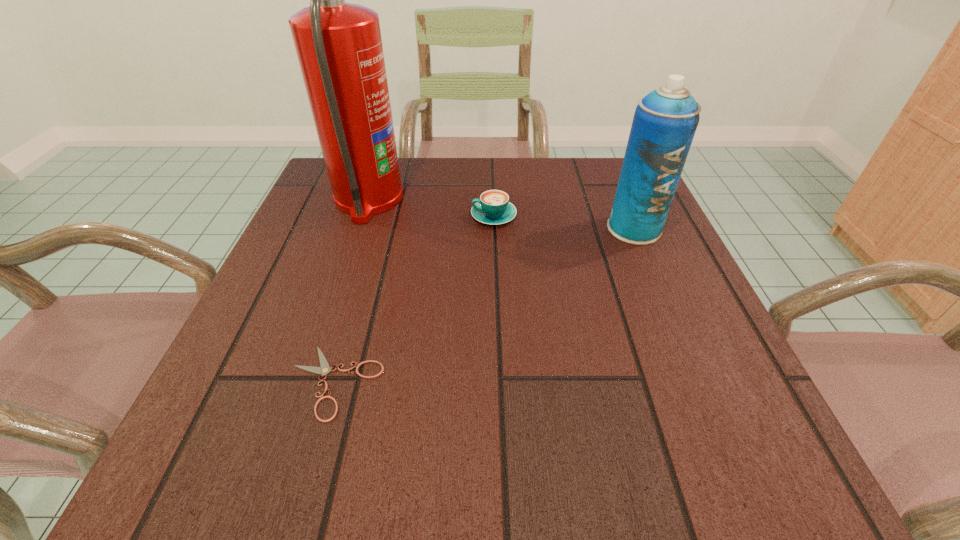
Where is `the tallest object`? the tallest object is located at coordinates coord(339,47).

Locate an element on the screen. Image resolution: width=960 pixels, height=540 pixels. the rightmost object is located at coordinates (665, 121).

At what (x,y) coordinates should I click in order to perform the action: click on the second tallest object. Please return your answer as a coordinate pair (x, y). Image resolution: width=960 pixels, height=540 pixels. Looking at the image, I should click on (665, 121).

The width and height of the screenshot is (960, 540). What are the coordinates of `the second object from right to left` in the screenshot? It's located at (493, 208).

Find the location of `cappuccino`. cappuccino is located at coordinates (493, 208).

In order to click on shears in this screenshot , I will do `click(324, 369)`.

Identify the location of the nearest object. (324, 369).

Where is `blank space located 0.310m on the instruction side of the tallest object`? This screenshot has height=540, width=960. blank space located 0.310m on the instruction side of the tallest object is located at coordinates (539, 200).

The height and width of the screenshot is (540, 960). I want to click on vacant area located 0.310m on the left of the second tallest object, so click(460, 228).

Where is `vacant space located with the handle on the right side of the cappuccino`? The image size is (960, 540). vacant space located with the handle on the right side of the cappuccino is located at coordinates (425, 216).